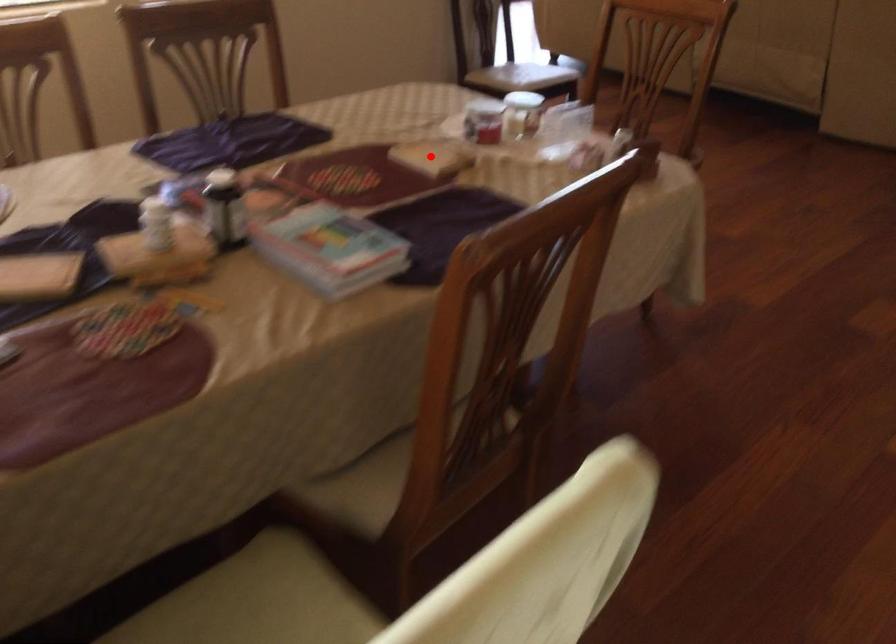
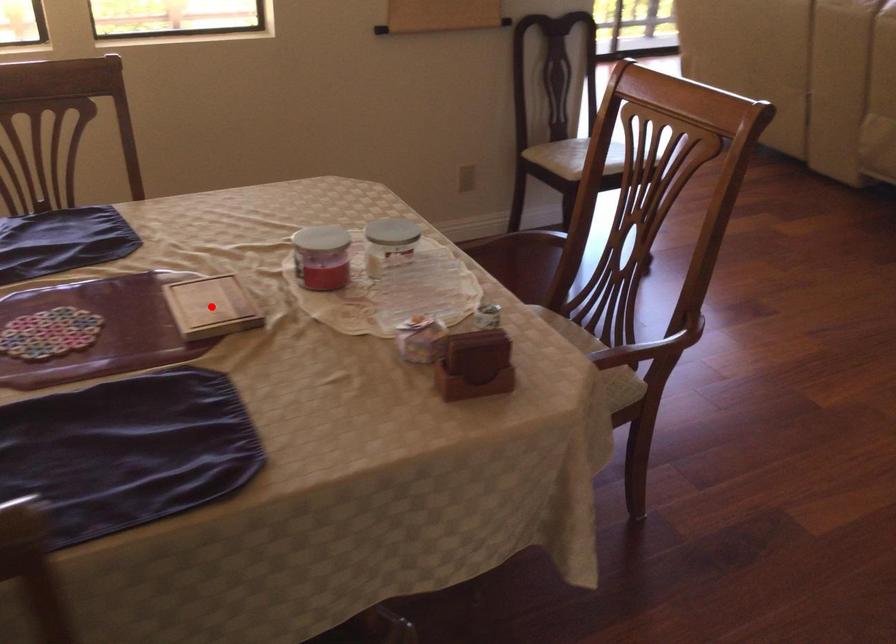
I am providing you with two images of the same scene from different viewpoints. A red point is marked on the first image and another point is marked on the second image. Do the highlighted points in image1 and image2 indicate the same real-world spot?

Yes